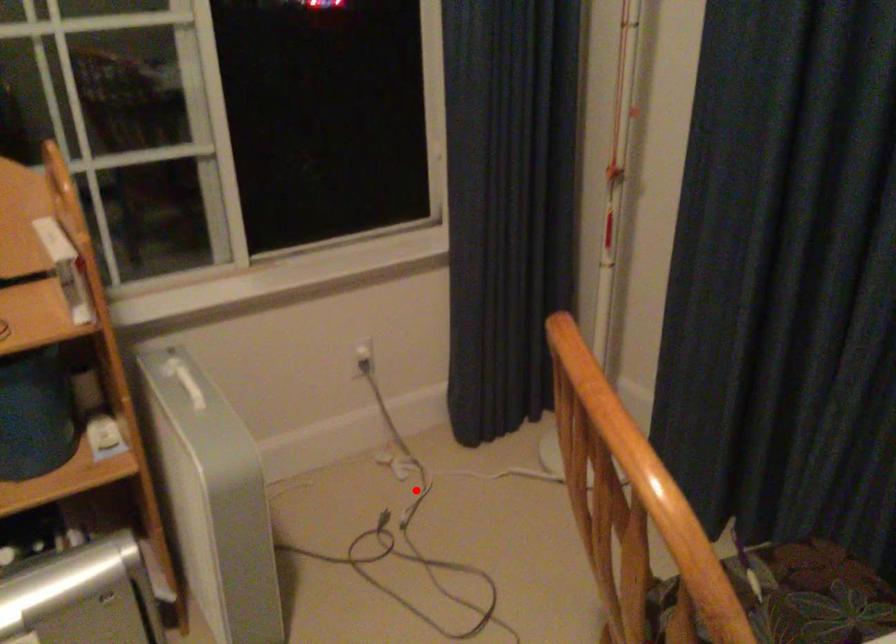
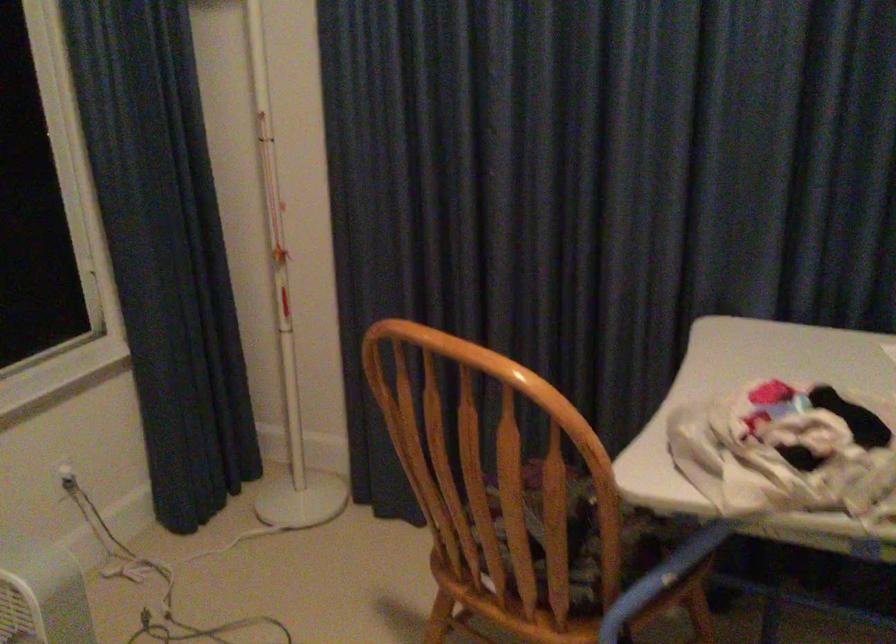
Find the pixel in the second image that matches the highlighted location in the first image.

(164, 581)